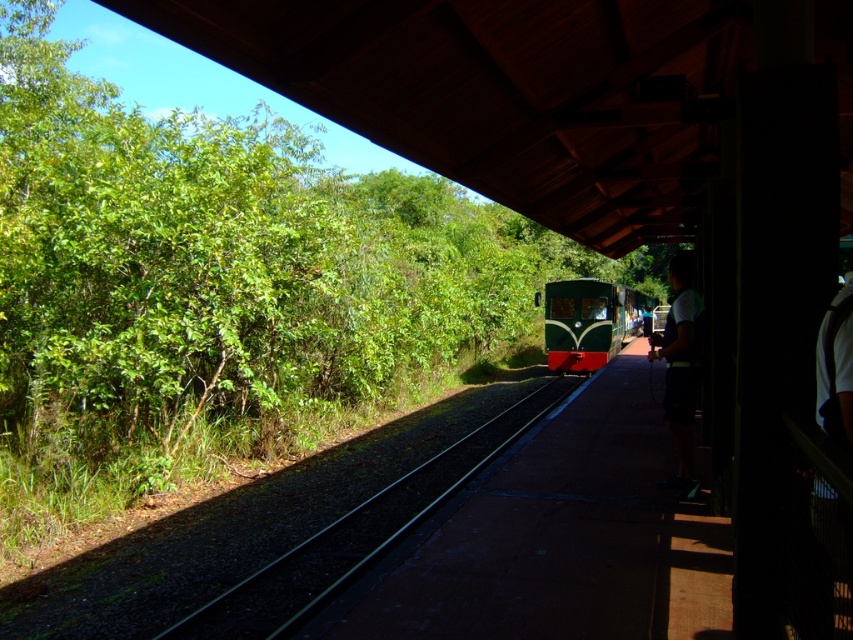
Is point (418, 483) closer to viewer compared to point (547, 289)?

Yes, it is.

This screenshot has width=853, height=640. What are the coordinates of `green gravel track at center` in the screenshot? It's located at (x=360, y=532).

Find the location of a particular element. Image resolution: width=853 pixels, height=640 pixels. green gravel track at center is located at coordinates (360, 532).

Is green gravel track at center shorter than dark blue shorts at right?

Indeed, green gravel track at center has a lesser height compared to dark blue shorts at right.

Does green gravel track at center have a lesser width compared to dark blue shorts at right?

No, green gravel track at center is not thinner than dark blue shorts at right.

Who is more forward, (x=314, y=605) or (x=682, y=300)?

Point (x=314, y=605) is in front.

Find the location of a particular element. This screenshot has height=640, width=853. green gravel track at center is located at coordinates (360, 532).

Which of these two, green matte train at center or dark blue shorts at right, stands shorter?

dark blue shorts at right

Describe the element at coordinates (589, 321) in the screenshot. The height and width of the screenshot is (640, 853). I see `green matte train at center` at that location.

Where is `green matte train at center`? green matte train at center is located at coordinates (589, 321).